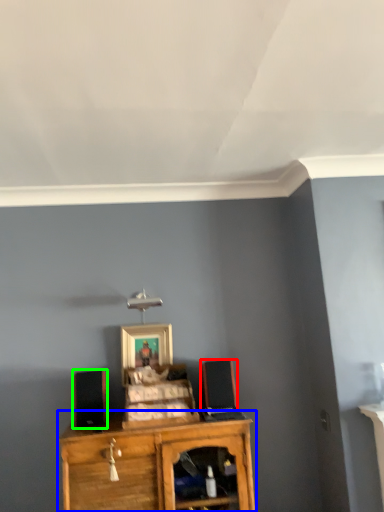
Question: Considering the real-world distances, which object is closest to speaker (highlighted by a red box)? shelf (highlighted by a blue box) or speaker (highlighted by a green box).

Choices:
 (A) shelf
 (B) speaker

Answer: (A)